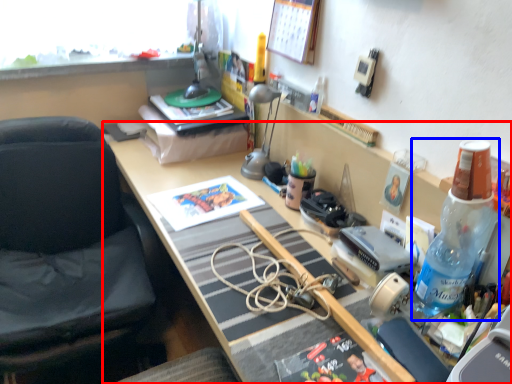
Question: Which point is closer to the camera, desk (highlighted by a red box) or bottle (highlighted by a blue box)?

Choices:
 (A) desk
 (B) bottle

Answer: (A)